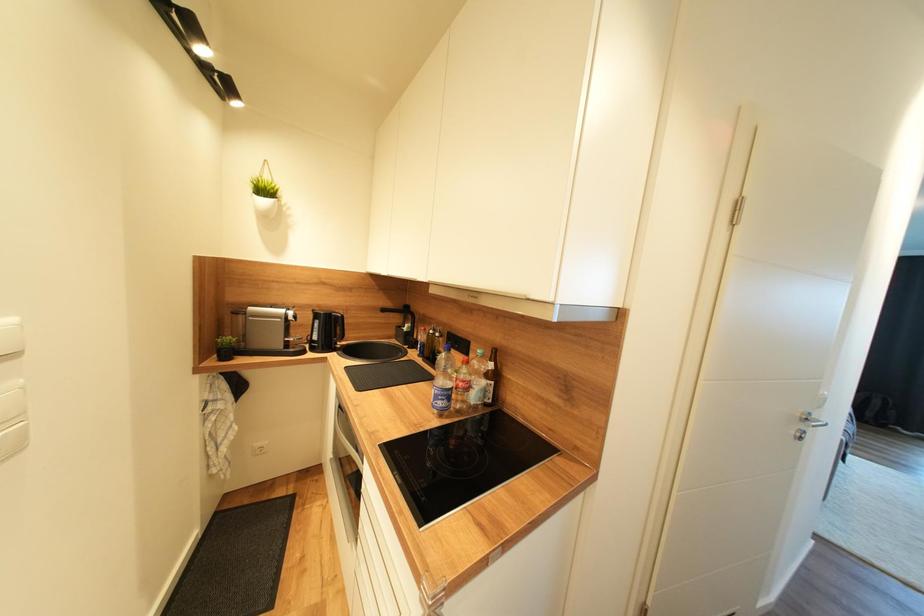
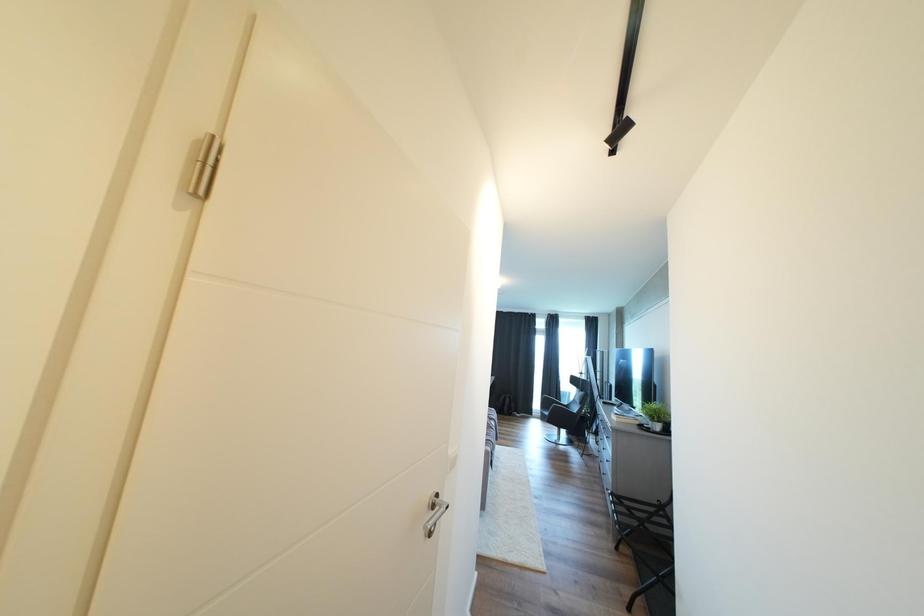
Question: Based on the continuous images, in which direction is the camera rotating? Reply with the corresponding letter.

Choices:
 (A) Left
 (B) Right
 (C) Up
 (D) Down

Answer: (B)